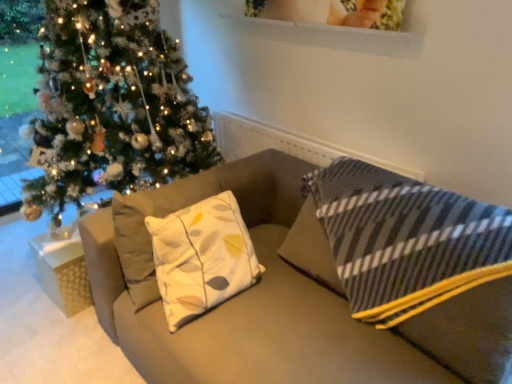
What do you see at coordinates (63, 270) in the screenshot?
I see `white textured gift box at lower left` at bounding box center [63, 270].

Locate an element on the screen. The height and width of the screenshot is (384, 512). matte beige couch at center is located at coordinates (276, 301).

Image resolution: width=512 pixels, height=384 pixels. Describe the element at coordinates (112, 106) in the screenshot. I see `shiny green christmas tree at left` at that location.

The height and width of the screenshot is (384, 512). I want to click on white textured gift box at lower left, so [x=63, y=270].

Is shiny green christmas tree at left oriented away from white textured gift box at lower left?

shiny green christmas tree at left does not have its back to white textured gift box at lower left.

Considering the relative sizes of shiny green christmas tree at left and white textured gift box at lower left in the image provided, is shiny green christmas tree at left wider than white textured gift box at lower left?

Yes, shiny green christmas tree at left is wider than white textured gift box at lower left.

Considering the positions of objects shiny green christmas tree at left and white textured gift box at lower left in the image provided, who is behind, shiny green christmas tree at left or white textured gift box at lower left?

white textured gift box at lower left.

Can you confirm if white textured gift box at lower left is shorter than shiny green christmas tree at left?

Yes.

Find the location of a particular element. Image resolution: width=512 pixels, height=384 pixels. christmas tree that appears above the white textured gift box at lower left (from a real-world perspective) is located at coordinates (112, 106).

Considering the relative positions of white textured gift box at lower left and shiny green christmas tree at left in the image provided, is white textured gift box at lower left to the left or to the right of shiny green christmas tree at left?

Clearly, white textured gift box at lower left is on the left of shiny green christmas tree at left in the image.

Would you say shiny green christmas tree at left is outside matte beige couch at center?

That's correct, shiny green christmas tree at left is outside of matte beige couch at center.

Which is more to the right, shiny green christmas tree at left or matte beige couch at center?

matte beige couch at center is more to the right.

Measure the distance from shiny green christmas tree at left to matte beige couch at center.

26.19 inches.

Is shiny green christmas tree at left facing away from matte beige couch at center?

shiny green christmas tree at left does not have its back to matte beige couch at center.

Is matte beige couch at center oriented towards white textured gift box at lower left?

No.

How far apart are matte beige couch at center and white textured gift box at lower left?

The distance of matte beige couch at center from white textured gift box at lower left is 24.09 inches.

The width and height of the screenshot is (512, 384). I want to click on furniture on the left of matte beige couch at center, so click(x=63, y=270).

Is matte beige couch at center next to white textured gift box at lower left and touching it?

No, matte beige couch at center is not making contact with white textured gift box at lower left.

Is white textured gift box at lower left oriented towards matte beige couch at center?

No, white textured gift box at lower left is not oriented towards matte beige couch at center.

Considering the sizes of objects white textured gift box at lower left and matte beige couch at center in the image provided, who is bigger, white textured gift box at lower left or matte beige couch at center?

Bigger between the two is matte beige couch at center.

Considering the relative positions of white textured gift box at lower left and matte beige couch at center in the image provided, is white textured gift box at lower left to the left or to the right of matte beige couch at center?

white textured gift box at lower left is positioned on matte beige couch at center's left side.

From the image's perspective, relative to matte beige couch at center, is white textured gift box at lower left above or below?

Based on their image positions, white textured gift box at lower left is located beneath matte beige couch at center.

Can you confirm if matte beige couch at center is shorter than shiny green christmas tree at left?

Yes.

Considering their positions, is matte beige couch at center located in front of or behind shiny green christmas tree at left?

Visually, matte beige couch at center is located in front of shiny green christmas tree at left.

Would you say matte beige couch at center is outside shiny green christmas tree at left?

A: Yes, matte beige couch at center is outside of shiny green christmas tree at left.

Is matte beige couch at center not close to shiny green christmas tree at left?

No, matte beige couch at center is not far from shiny green christmas tree at left.

Identify the location of christmas tree lying above the white textured gift box at lower left (from the image's perspective). This screenshot has width=512, height=384. (112, 106).

The width and height of the screenshot is (512, 384). In order to click on furniture below the shiny green christmas tree at left (from the image's perspective) in this screenshot , I will do `click(63, 270)`.

From the image, which object appears to be farther from white textured gift box at lower left, matte beige couch at center or shiny green christmas tree at left?

Based on the image, matte beige couch at center appears to be further to white textured gift box at lower left.

Based on their spatial positions, is matte beige couch at center or white textured gift box at lower left closer to shiny green christmas tree at left?

The object closer to shiny green christmas tree at left is white textured gift box at lower left.

Looking at the image, which one is located closer to matte beige couch at center, shiny green christmas tree at left or white textured gift box at lower left?

white textured gift box at lower left.

Considering their positions, is shiny green christmas tree at left positioned further to white textured gift box at lower left than matte beige couch at center?

matte beige couch at center is positioned further to the anchor white textured gift box at lower left.

When comparing their distances from shiny green christmas tree at left, does white textured gift box at lower left or matte beige couch at center seem further?

matte beige couch at center is positioned further to the anchor shiny green christmas tree at left.

Looking at the image, which one is located closer to matte beige couch at center, white textured gift box at lower left or shiny green christmas tree at left?

white textured gift box at lower left.

The width and height of the screenshot is (512, 384). Identify the location of christmas tree between matte beige couch at center and white textured gift box at lower left from front to back. (112, 106).